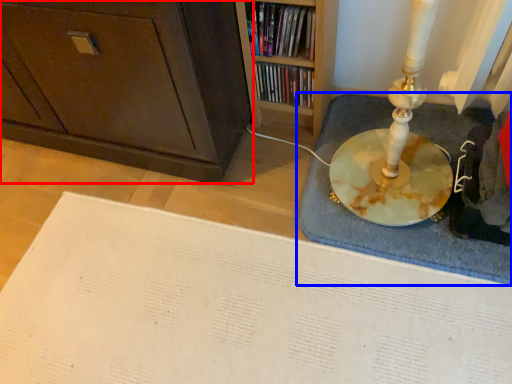
Question: Which object is further to the camera taking this photo, cabinetry (highlighted by a red box) or bath mat (highlighted by a blue box)?

Choices:
 (A) cabinetry
 (B) bath mat

Answer: (B)